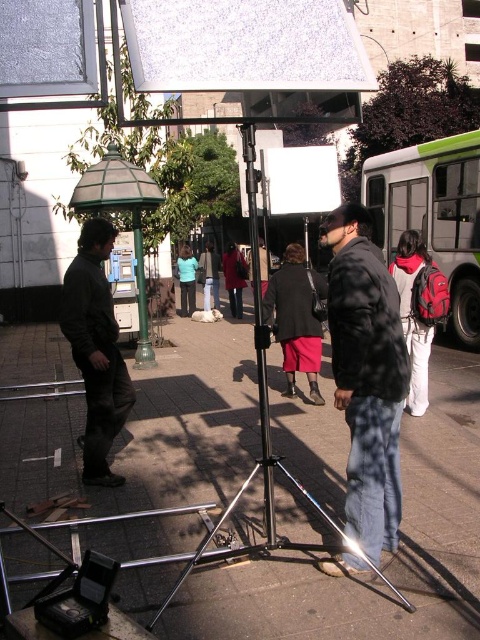
Does dark green jacket at left appear on the left side of red wool coat at center?

Correct, you'll find dark green jacket at left to the left of red wool coat at center.

What are the coordinates of `dark green jacket at left` in the screenshot? It's located at (96, 349).

Locate an element on the screen. The height and width of the screenshot is (640, 480). dark green jacket at left is located at coordinates (96, 349).

Which is above, slate gray pavement at center or matte teal shirt at center?

matte teal shirt at center is above.

Which is in front, point (139, 452) or point (184, 294)?

Point (139, 452)

You are a GUI agent. You are given a task and a screenshot of the screen. Output one action in this format:
    pyautogui.click(x=<x>, y=<y>)
    Task: Click on the slate gray pavement at center
    
    Given the screenshot: What is the action you would take?
    pyautogui.click(x=391, y=557)

Is slate gray pavement at center bigger than white paper at upper center?

No, slate gray pavement at center is not bigger than white paper at upper center.

Does point (172, 348) lie behind point (215, 1)?

Yes, point (172, 348) is behind point (215, 1).

Between point (177, 333) and point (283, 1), which one is positioned behind?

The point (177, 333) is more distant.

The width and height of the screenshot is (480, 640). In order to click on slate gray pavement at center in this screenshot , I will do `click(391, 557)`.